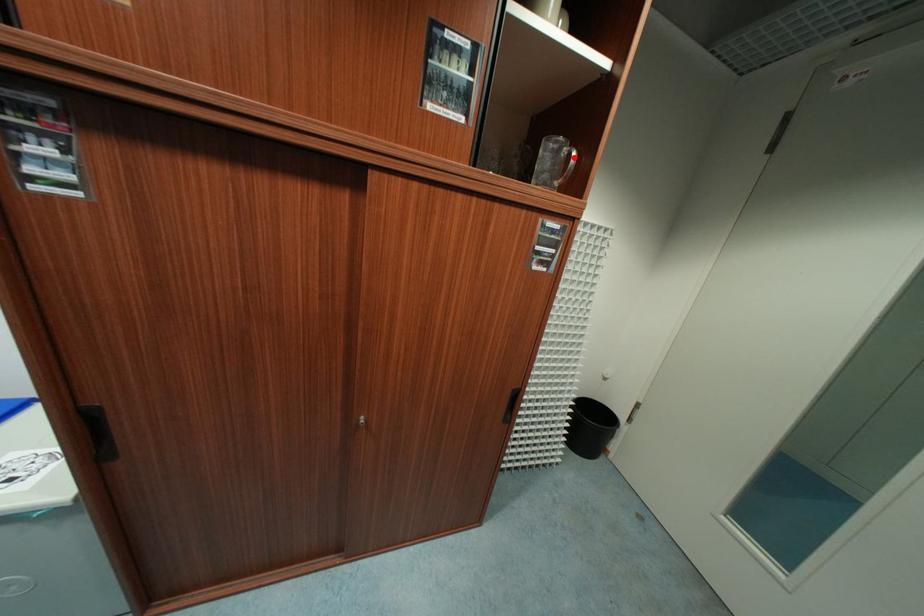
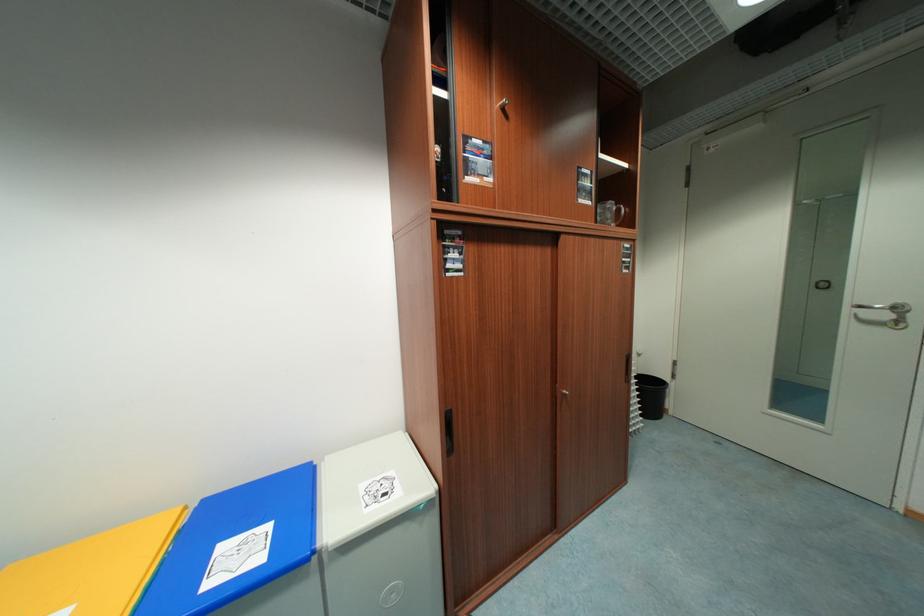
Find the pixel in the second image that matches the highlighted location in the first image.

(624, 211)